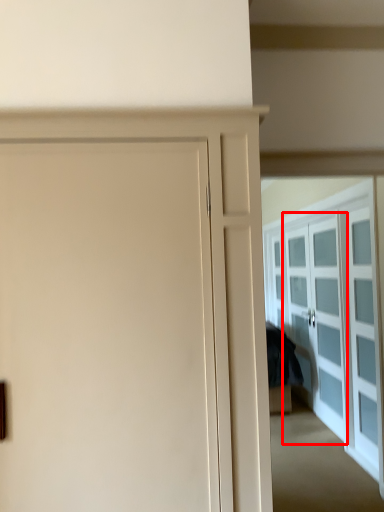
Question: From the image's perspective, what is the correct spatial relationship of screen door (annotated by the red box) in relation to door?

Choices:
 (A) above
 (B) below

Answer: (B)